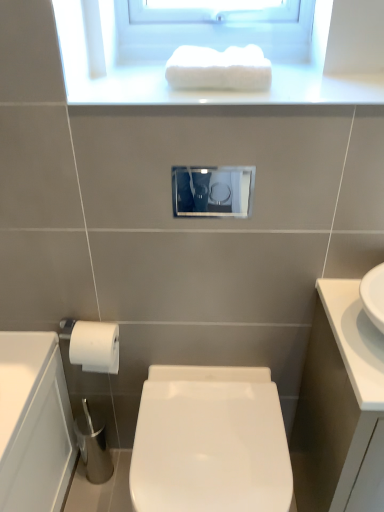
I want to click on white fluffy towel at upper center, so click(x=219, y=69).

What do you see at coordinates (213, 191) in the screenshot? This screenshot has width=384, height=512. I see `matte glass medicine cabinet at center` at bounding box center [213, 191].

You are a GUI agent. You are given a task and a screenshot of the screen. Output one action in this format:
    pyautogui.click(x=<x>, y=<y>)
    Task: Click on the white glossy toilet at center
    
    Given the screenshot: What is the action you would take?
    pyautogui.click(x=210, y=442)

Measure the distance between white glossy towel at upper center and camera.

white glossy towel at upper center is 34.30 inches from camera.

The image size is (384, 512). What do you see at coordinates (338, 403) in the screenshot? I see `white glossy cabinet at right` at bounding box center [338, 403].

This screenshot has height=512, width=384. I want to click on white fluffy towel at upper center, so click(x=219, y=69).

From a real-world perspective, is matte glass medicine cabinet at center above or below white glossy cabinet at right?

matte glass medicine cabinet at center is situated higher than white glossy cabinet at right in the real world.

Is matte glass medicine cabinet at center aimed at white glossy cabinet at right?

No, matte glass medicine cabinet at center is not turned towards white glossy cabinet at right.

What's the angular difference between matte glass medicine cabinet at center and white glossy cabinet at right's facing directions?

There is a 0.146-degree angle between the facing directions of matte glass medicine cabinet at center and white glossy cabinet at right.

Is point (189, 197) positioned after point (360, 333)?

Yes.

Identify the location of hand towel behind the white glossy cabinet at right. The width and height of the screenshot is (384, 512). click(x=219, y=69).

Does white glossy cabinet at right have a smaller size compared to white fluffy towel at upper center?

No, white glossy cabinet at right is not smaller than white fluffy towel at upper center.

From the image's perspective, is white glossy cabinet at right above or below white fluffy towel at upper center?

Clearly, from the image's perspective, white glossy cabinet at right is below white fluffy towel at upper center.

Is white glossy cabinet at right oriented away from white glossy towel at upper center?

No, white glossy cabinet at right's orientation is not away from white glossy towel at upper center.

Does point (330, 365) lie in front of point (250, 95)?

No.

Which of these two, white glossy cabinet at right or white glossy towel at upper center, is bigger?

Bigger between the two is white glossy cabinet at right.

In the scene shown: Can we say white glossy towel at upper center lies outside white glossy toilet at center?

Absolutely, white glossy towel at upper center is external to white glossy toilet at center.

Considering the sizes of white glossy towel at upper center and white glossy toilet at center in the image, is white glossy towel at upper center taller or shorter than white glossy toilet at center?

In the image, white glossy towel at upper center appears to be shorter than white glossy toilet at center.

This screenshot has width=384, height=512. What are the coordinates of `toilet that appears below the white glossy towel at upper center (from a real-world perspective)` in the screenshot? It's located at (210, 442).

Can you confirm if white fluffy towel at upper center is bigger than white glossy toilet at center?

Actually, white fluffy towel at upper center might be smaller than white glossy toilet at center.

Are white fluffy towel at upper center and white glossy toilet at center making contact?

white fluffy towel at upper center and white glossy toilet at center are clearly separated.

Based on the photo, is white fluffy towel at upper center looking in the opposite direction of white glossy toilet at center?

No, white glossy toilet at center is not at the back of white fluffy towel at upper center.

The width and height of the screenshot is (384, 512). I want to click on hand towel that is above the white glossy toilet at center (from the image's perspective), so click(x=219, y=69).

From a real-world perspective, who is located lower, white fluffy towel at upper center or matte glass medicine cabinet at center?

From a 3D spatial view, matte glass medicine cabinet at center is below.

Are white fluffy towel at upper center and matte glass medicine cabinet at center making contact?

white fluffy towel at upper center and matte glass medicine cabinet at center are clearly separated.

From the image's perspective, is white fluffy towel at upper center beneath matte glass medicine cabinet at center?

No.

Is the depth of white glossy towel at upper center greater than that of white fluffy towel at upper center?

No, white glossy towel at upper center is closer to the viewer.

I want to click on window sill located in front of the white fluffy towel at upper center, so tap(221, 91).

Considering the sizes of objects white glossy towel at upper center and white fluffy towel at upper center in the image provided, who is bigger, white glossy towel at upper center or white fluffy towel at upper center?

Bigger between the two is white glossy towel at upper center.

In order to click on bathroom cabinet located below the matte glass medicine cabinet at center (from the image's perspective) in this screenshot , I will do pyautogui.click(x=338, y=403).

Where is `hand towel on the left of white glossy cabinet at right`? The width and height of the screenshot is (384, 512). hand towel on the left of white glossy cabinet at right is located at coordinates (219, 69).

Based on the photo, considering their positions, is white glossy cabinet at right positioned closer to white glossy towel at upper center than white glossy toilet at center?

white glossy cabinet at right.

Looking at the image, which one is located further to matte glass medicine cabinet at center, white fluffy towel at upper center or white glossy toilet at center?

white fluffy towel at upper center is positioned further to the anchor matte glass medicine cabinet at center.

Which object lies further to the anchor point white glossy cabinet at right, white fluffy towel at upper center or white glossy toilet at center?

white fluffy towel at upper center is further to white glossy cabinet at right.

Estimate the real-world distances between objects in this image. Which object is further from white glossy cabinet at right, white glossy towel at upper center or matte glass medicine cabinet at center?

matte glass medicine cabinet at center is positioned further to the anchor white glossy cabinet at right.

When comparing their distances from white glossy towel at upper center, does matte glass medicine cabinet at center or white fluffy towel at upper center seem closer?

Based on the image, white fluffy towel at upper center appears to be nearer to white glossy towel at upper center.

Estimate the real-world distances between objects in this image. Which object is further from matte glass medicine cabinet at center, white glossy toilet at center or white glossy cabinet at right?

Among the two, white glossy cabinet at right is located further to matte glass medicine cabinet at center.

From the image, which object appears to be nearer to matte glass medicine cabinet at center, white fluffy towel at upper center or white glossy cabinet at right?

The object closer to matte glass medicine cabinet at center is white fluffy towel at upper center.

Based on their spatial positions, is white glossy toilet at center or white fluffy towel at upper center further from white glossy towel at upper center?

Among the two, white glossy toilet at center is located further to white glossy towel at upper center.

Locate an element on the screen. window sill between white fluffy towel at upper center and white glossy toilet at center in the up-down direction is located at coordinates (221, 91).

Where is `medicine cabinet between white glossy towel at upper center and white glossy cabinet at right in the vertical direction`? This screenshot has width=384, height=512. medicine cabinet between white glossy towel at upper center and white glossy cabinet at right in the vertical direction is located at coordinates (213, 191).

At what (x,y) coordinates should I click in order to perform the action: click on medicine cabinet between white fluffy towel at upper center and white glossy toilet at center vertically. Please return your answer as a coordinate pair (x, y). The height and width of the screenshot is (512, 384). Looking at the image, I should click on (213, 191).

You are a GUI agent. You are given a task and a screenshot of the screen. Output one action in this format:
    pyautogui.click(x=<x>, y=<y>)
    Task: Click on the bathroom cabinet that lies between matte glass medicine cabinet at center and white glossy toilet at center from top to bottom
    The image size is (384, 512).
    Given the screenshot: What is the action you would take?
    pyautogui.click(x=338, y=403)